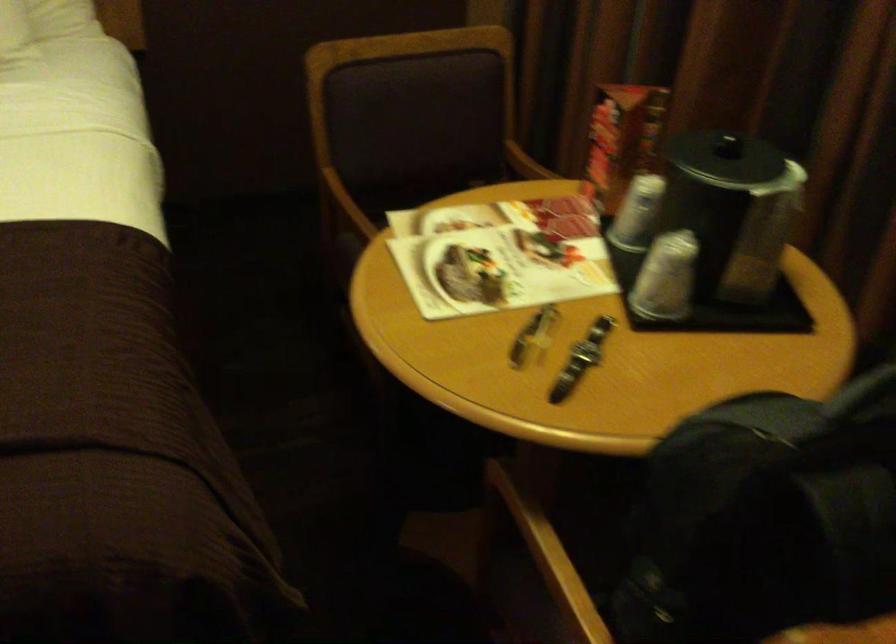
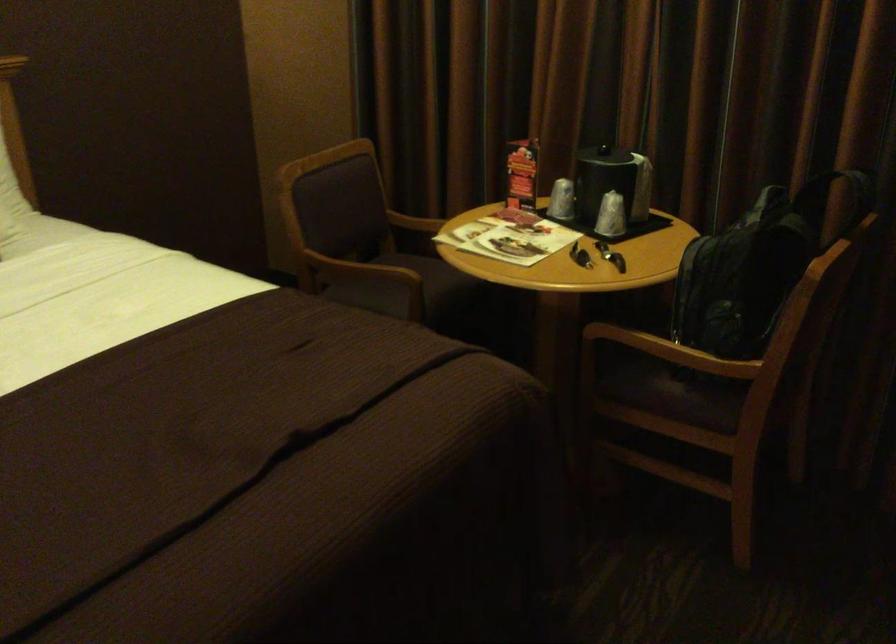
In the second image, find the point that corresponds to point 347,216 in the first image.

(349, 268)